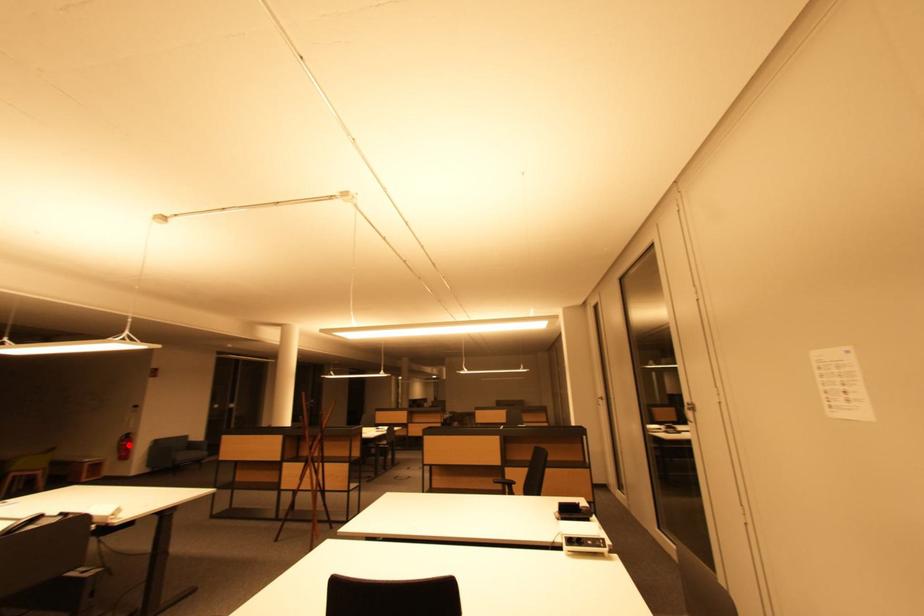
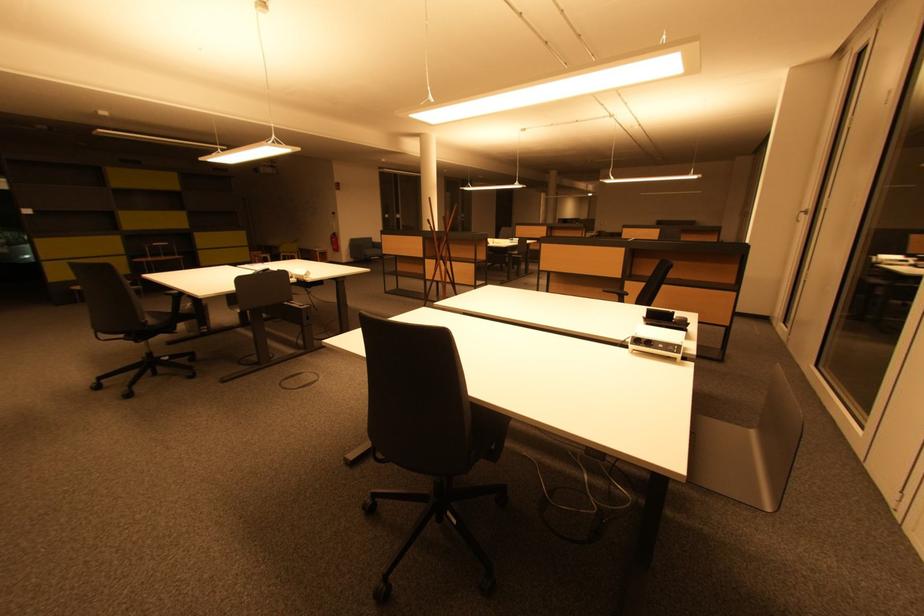
In the second image, find the point that corresponds to the highlighted location in the first image.

(338, 241)